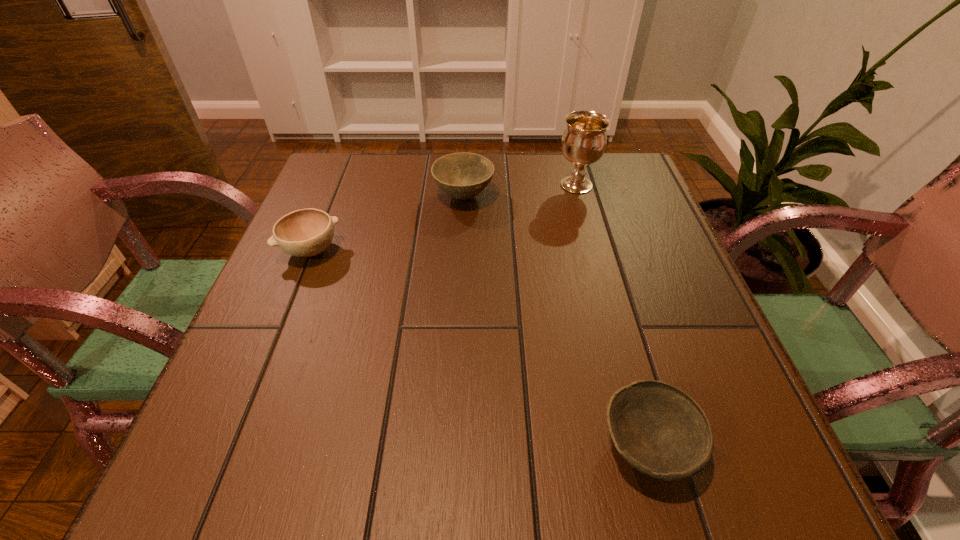
You are a GUI agent. You are given a task and a screenshot of the screen. Output one action in this format:
    pyautogui.click(x=<x>, y=<y>)
    Task: Click on the vacant space that satisfies the following two spatial constraints: 1. on the front side of the farthest bowl; 2. on the left side of the nearest object
    This screenshot has height=540, width=960.
    Given the screenshot: What is the action you would take?
    pyautogui.click(x=452, y=446)

Locate an element on the screen. Image resolution: width=960 pixels, height=540 pixels. vacant space that satisfies the following two spatial constraints: 1. on the back side of the chalice; 2. on the left side of the third object from right to left is located at coordinates (465, 185).

I want to click on vacant region that satisfies the following two spatial constraints: 1. on the back side of the second object from left to right; 2. on the left side of the tallest object, so click(465, 185).